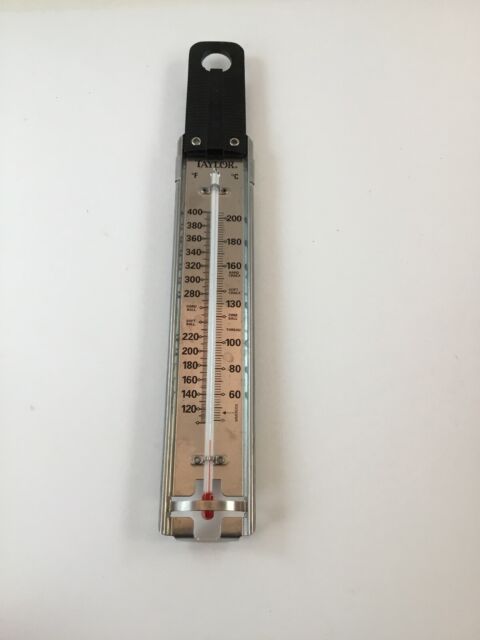
Locate an element on the screen. Image resolution: width=480 pixels, height=640 pixels. table is located at coordinates (366, 397), (99, 429).